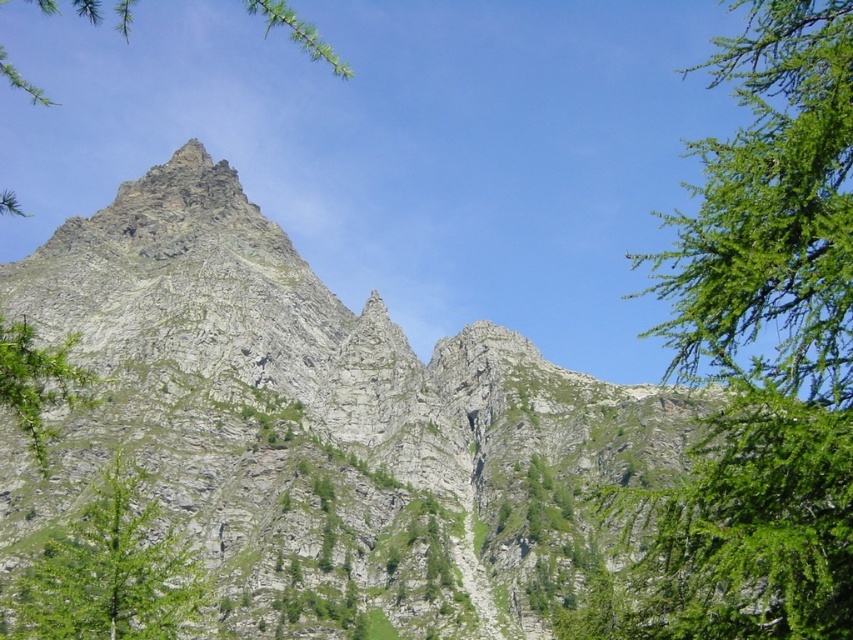
Between green leafy tree at upper right and green leafy tree at lower left, which one has less height?

green leafy tree at lower left is shorter.

Who is more distant from viewer, (x=793, y=449) or (x=103, y=564)?

Positioned behind is point (x=103, y=564).

The width and height of the screenshot is (853, 640). I want to click on green leafy tree at upper right, so click(761, 355).

Can you confirm if green leafy shrub at left is positioned below green leafy tree at upper center?

Indeed, green leafy shrub at left is positioned under green leafy tree at upper center.

The image size is (853, 640). What are the coordinates of `green leafy shrub at left` in the screenshot? It's located at (38, 381).

You are a GUI agent. You are given a task and a screenshot of the screen. Output one action in this format:
    pyautogui.click(x=<x>, y=<y>)
    Task: Click on the green leafy shrub at left
    
    Given the screenshot: What is the action you would take?
    pyautogui.click(x=38, y=381)

In the scene shown: Between green leafy shrub at left and green lichen-covered rock at upper center, which one is positioned higher?

Positioned higher is green lichen-covered rock at upper center.

Looking at this image, is green leafy shrub at left further to camera compared to green lichen-covered rock at upper center?

No, green leafy shrub at left is in front of green lichen-covered rock at upper center.

Does point (28, 374) come farther from viewer compared to point (258, 1)?

No, (28, 374) is closer to viewer.

At what (x,y) coordinates should I click in order to perform the action: click on green leafy shrub at left. Please return your answer as a coordinate pair (x, y). Image resolution: width=853 pixels, height=640 pixels. Looking at the image, I should click on (38, 381).